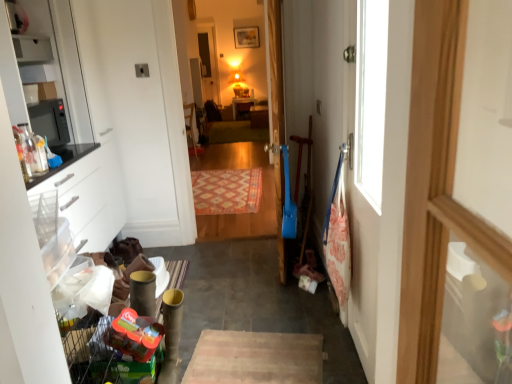
Question: Do you think blue plastic door at center is within translucent plastic toy at lower left, or outside of it?

Choices:
 (A) outside
 (B) inside

Answer: (A)

Question: From a real-world perspective, relative to translucent plastic toy at lower left, is blue plastic door at center vertically above or below?

Choices:
 (A) below
 (B) above

Answer: (B)

Question: Which object is the farthest from the green carpet at center, which is the second mat from bottom to top?

Choices:
 (A) matte white cabinet at center, positioned as the first cabinetry in top-to-bottom order
 (B) orange woven rug at center, the 1th mat when ordered from front to back
 (C) blue plastic door at center
 (D) matte white shelf at upper left
 (E) carpeted wooden floor at center

Answer: (D)

Question: Which object is the farthest from the blue plastic door at center?

Choices:
 (A) wooden picture frame at upper center
 (B) wooden table at center
 (C) white matte cabinet at left, marked as the 1th cabinetry in a bottom-to-top arrangement
 (D) matte white cabinet at center, arranged as the 2th cabinetry when ordered from the bottom
 (E) green carpet at center, which is counted as the second mat, starting from the front

Answer: (B)